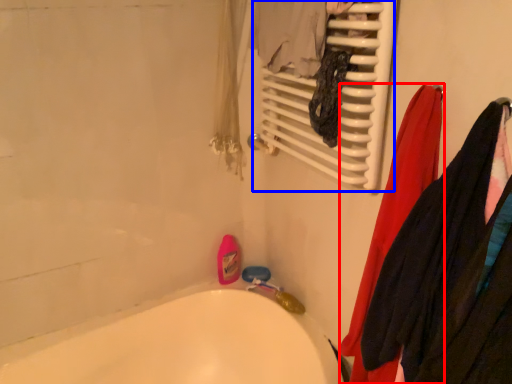
Question: Which of the following is the closest to the observer, clothing (highlighted by a red box) or radiator (highlighted by a blue box)?

Choices:
 (A) clothing
 (B) radiator

Answer: (A)